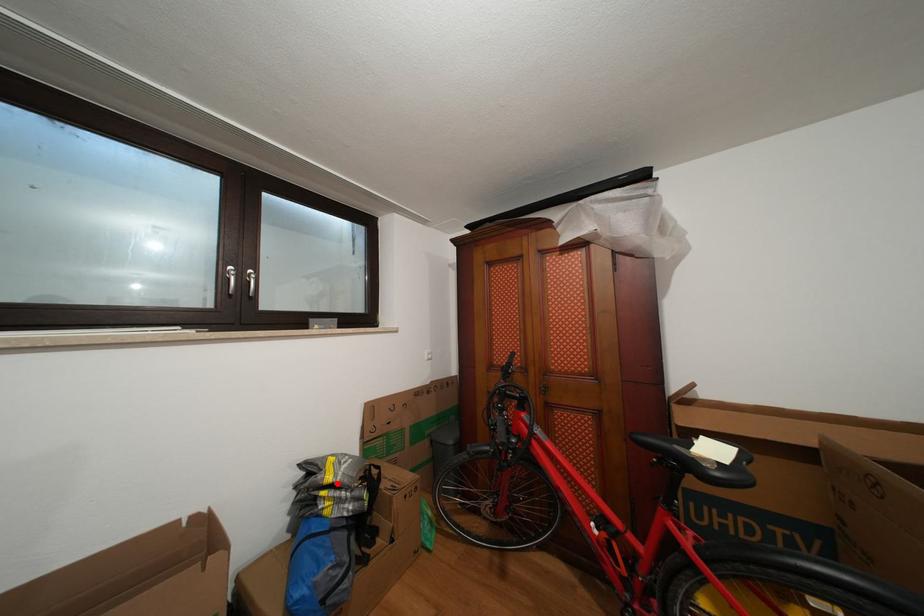
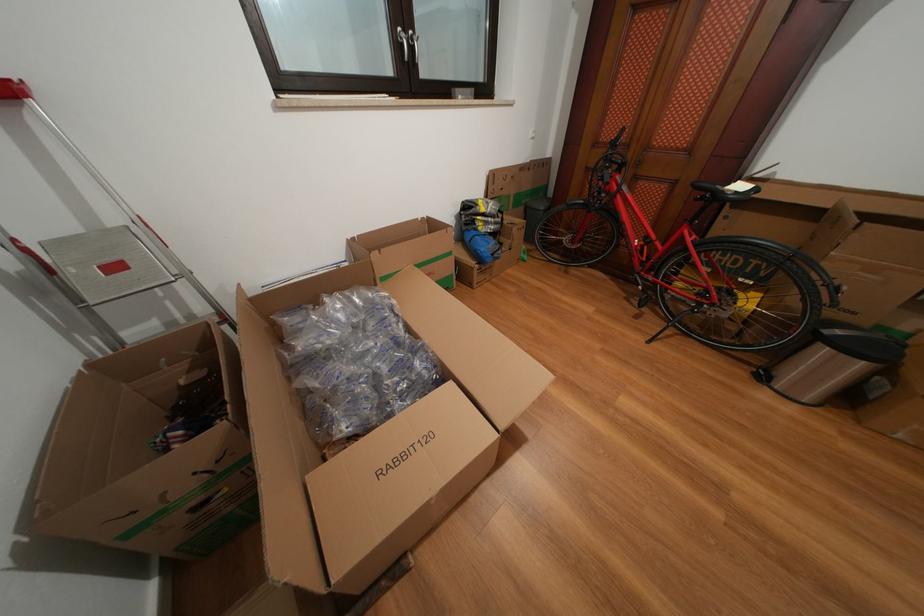
The point at the highlighted location is marked in the first image. Where is the corresponding point in the second image?

(491, 215)